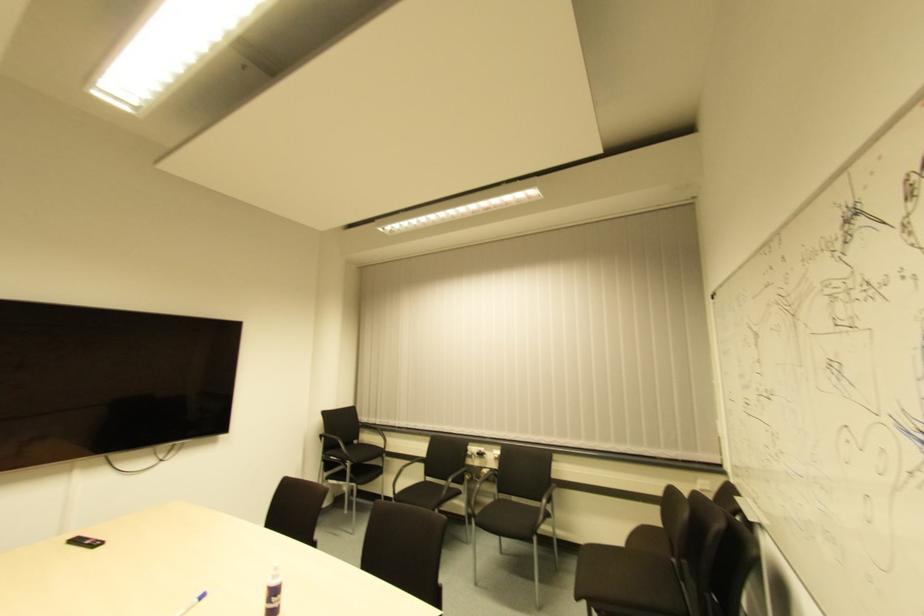
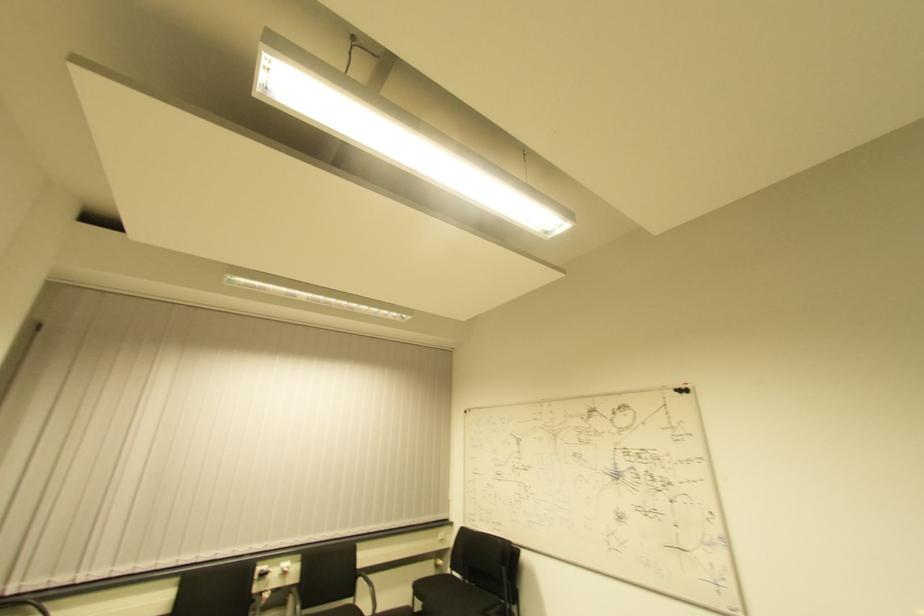
Locate, in the second image, the point that corresponds to (494,462) in the first image.

(283, 576)